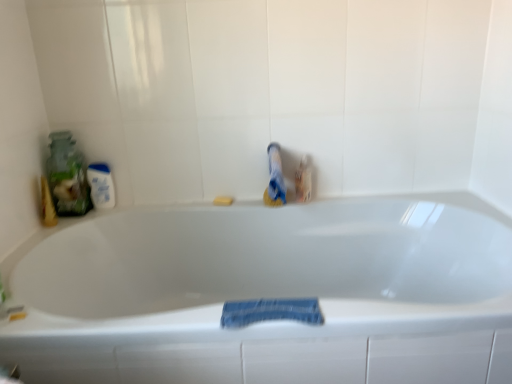
Question: Considering the relative sizes of translucent glass jar at left and white glossy bathtub at center in the image provided, is translucent glass jar at left bigger than white glossy bathtub at center?

Choices:
 (A) yes
 (B) no

Answer: (B)

Question: Does translucent glass jar at left turn towards white glossy bathtub at center?

Choices:
 (A) yes
 (B) no

Answer: (B)

Question: Is translucent glass jar at left touching white glossy bathtub at center?

Choices:
 (A) yes
 (B) no

Answer: (B)

Question: Is the position of translucent glass jar at left more distant than that of white glossy bathtub at center?

Choices:
 (A) no
 (B) yes

Answer: (B)

Question: Does translucent glass jar at left lie in front of white glossy bathtub at center?

Choices:
 (A) no
 (B) yes

Answer: (A)

Question: Can you confirm if translucent glass jar at left is taller than white glossy bathtub at center?

Choices:
 (A) no
 (B) yes

Answer: (A)

Question: Is white glossy bathtub at center to the left of translucent glass jar at left from the viewer's perspective?

Choices:
 (A) no
 (B) yes

Answer: (A)

Question: Considering the relative sizes of white glossy bathtub at center and translucent glass jar at left in the image provided, is white glossy bathtub at center thinner than translucent glass jar at left?

Choices:
 (A) yes
 (B) no

Answer: (B)

Question: From a real-world perspective, does white glossy bathtub at center sit lower than translucent glass jar at left?

Choices:
 (A) no
 (B) yes

Answer: (B)

Question: Is white glossy bathtub at center positioned beyond the bounds of translucent glass jar at left?

Choices:
 (A) yes
 (B) no

Answer: (A)

Question: Does white glossy bathtub at center have a smaller size compared to translucent glass jar at left?

Choices:
 (A) yes
 (B) no

Answer: (B)

Question: Does white glossy bathtub at center have a lesser height compared to translucent glass jar at left?

Choices:
 (A) no
 (B) yes

Answer: (A)

Question: Does white glossy mouthwash at left come behind white glossy bathtub at center?

Choices:
 (A) yes
 (B) no

Answer: (A)